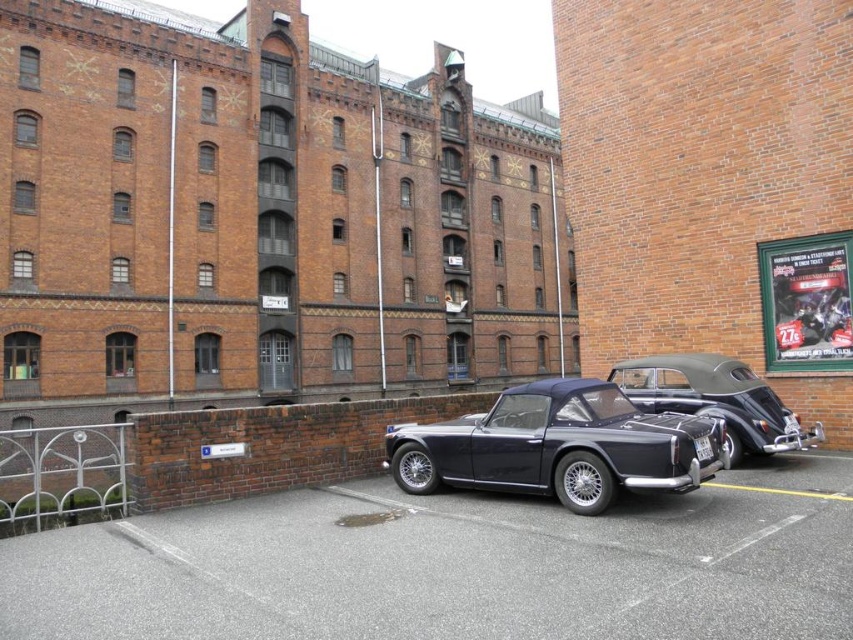
You are driving a truck that is 2 meters wide. You want to park in the parking area shown in the image. Can your truck fit in the parking space between the black asphalt parking lot at center and the shiny black convertible at center?

The black asphalt parking lot at center is wider than the shiny black convertible at center, so the truck that is 2 meters wide can fit in the parking space between them as long as the parking space is at least 2 meters wide.

What is located at the coordinates point (x=454, y=564) in the parking area?

The black asphalt parking lot at center is located at point (x=454, y=564).